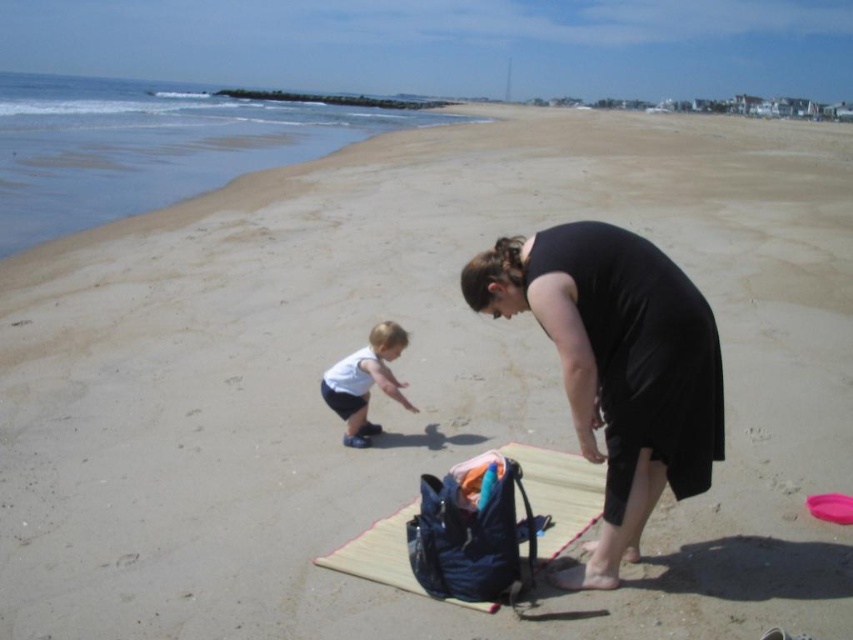
Between black matte dress at center and white matte shorts at lower left, which one has less height?

white matte shorts at lower left

Between black matte dress at center and white matte shorts at lower left, which one appears on the left side from the viewer's perspective?

From the viewer's perspective, white matte shorts at lower left appears more on the left side.

Does point (585, 339) lie in front of point (372, 333)?

Yes.

This screenshot has height=640, width=853. In order to click on black matte dress at center in this screenshot , I will do `click(618, 365)`.

Does beige woven mat at center appear on the right side of white matte shorts at lower left?

Yes, beige woven mat at center is to the right of white matte shorts at lower left.

Consider the image. Is beige woven mat at center above white matte shorts at lower left?

No, beige woven mat at center is not above white matte shorts at lower left.

Does point (402, 556) lie in front of point (352, 365)?

Yes.

Image resolution: width=853 pixels, height=640 pixels. I want to click on beige woven mat at center, so click(560, 492).

Can you confirm if black matte dress at center is taller than beige woven mat at center?

Yes.

Which is in front, point (602, 456) or point (567, 522)?

Point (602, 456) is more forward.

Which is in front, point (585, 253) or point (555, 513)?

Positioned in front is point (585, 253).

Where is `black matte dress at center`? Image resolution: width=853 pixels, height=640 pixels. black matte dress at center is located at coordinates (618, 365).